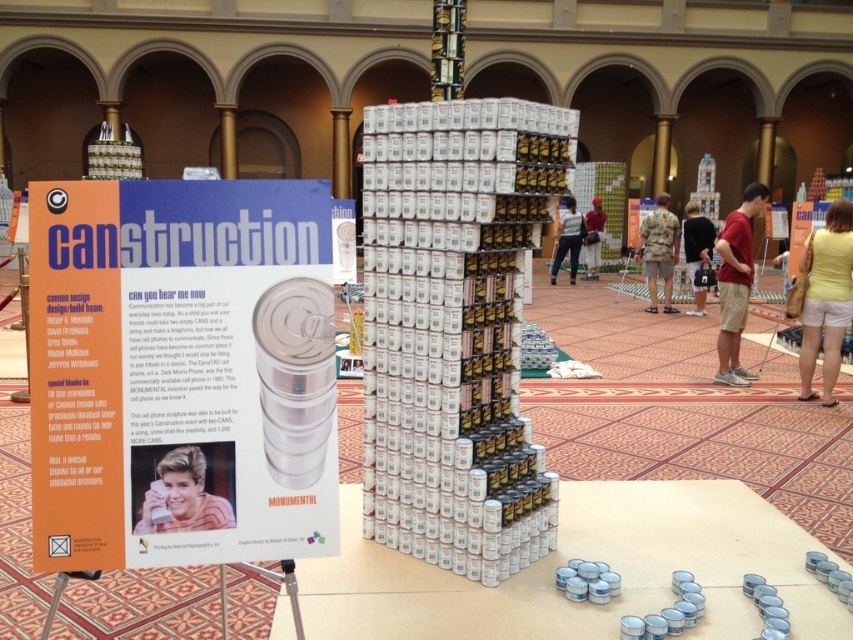
Question: Does camouflage fabric shorts at center have a larger size compared to dark blue shirt at center?

Choices:
 (A) no
 (B) yes

Answer: (A)

Question: Can you confirm if orange paper poster at upper left is thinner than camouflage fabric shorts at center?

Choices:
 (A) no
 (B) yes

Answer: (B)

Question: Can you confirm if dark blue shirt at center is bigger than denim pants at center?

Choices:
 (A) no
 (B) yes

Answer: (A)

Question: Estimate the real-world distances between objects in this image. Which object is farther from the matte red shirt at center?

Choices:
 (A) yellow cotton shorts at lower right
 (B) denim pants at center
 (C) smooth plastic phone at center

Answer: (B)

Question: Which of these objects is positioned closest to the orange paper poster at upper left?

Choices:
 (A) camouflage fabric shorts at center
 (B) dark blue shirt at center

Answer: (B)

Question: Which point is closer to the camera?

Choices:
 (A) camouflage fabric shorts at center
 (B) dark blue shirt at center
 (C) matte red shirt at center
 (D) smooth plastic phone at center

Answer: (D)